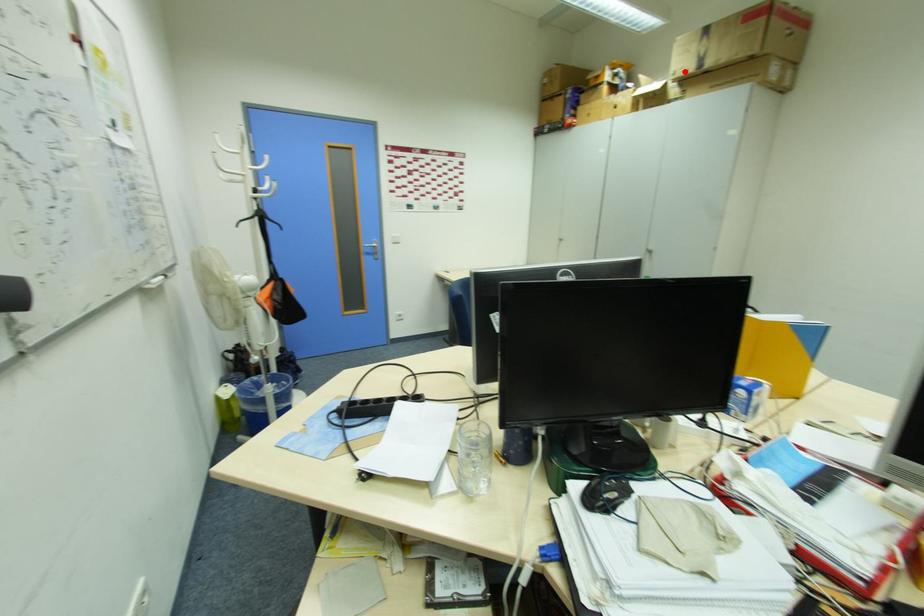
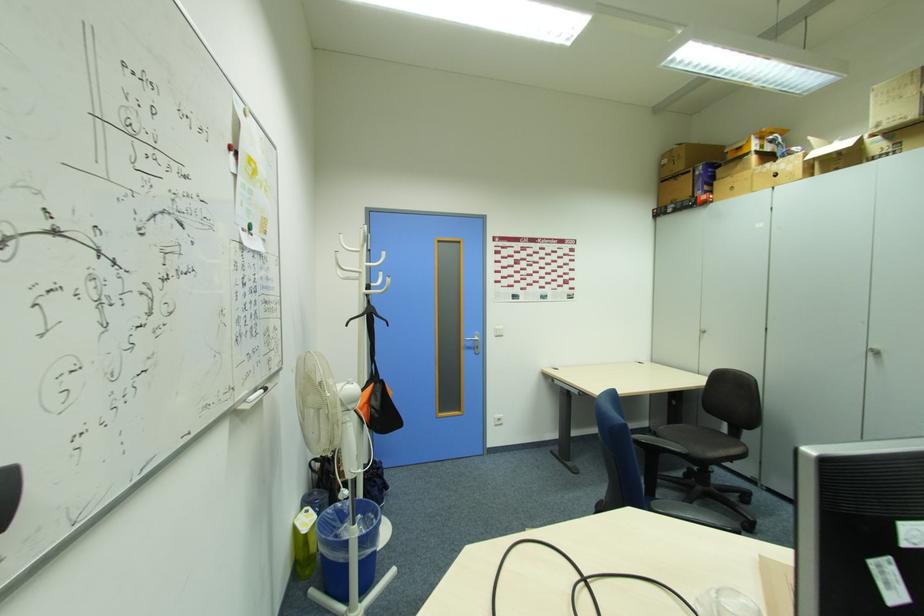
Question: I am providing you with two images of the same scene from different viewpoints. In image1, a red point is highlighted. Considering the same 3D point in image2, which of the following is correct?

Choices:
 (A) It is closer
 (B) It is farther

Answer: (B)